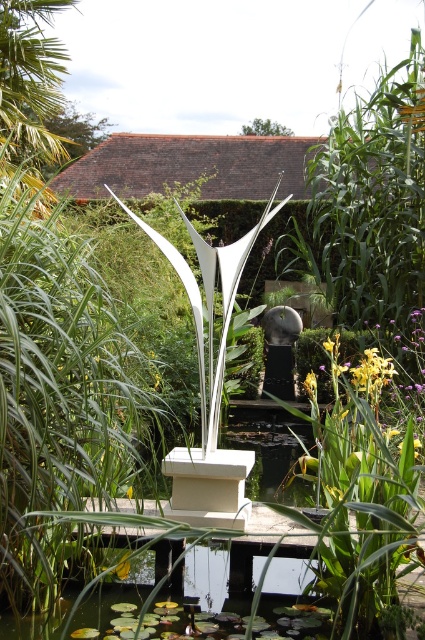
You are an art curator planning to display both the white glossy sculpture at center and the satin silver sculpture at center in a new exhibition. Given their widths, which sculpture would require more horizontal space to accommodate its base?

The white glossy sculpture at center requires more horizontal space because its width surpasses that of the satin silver sculpture at center.

You are standing in the garden and want to take a photo of both the white glossy sculpture at center and the satin silver sculpture at center. Since you can only focus on one sculpture at a time, which one should you aim your camera at first to ensure the other is still in the frame?

You should aim your camera at the white glossy sculpture at center first because it is positioned to the left of the satin silver sculpture at center, so capturing it first will keep the other sculpture in the frame as well.